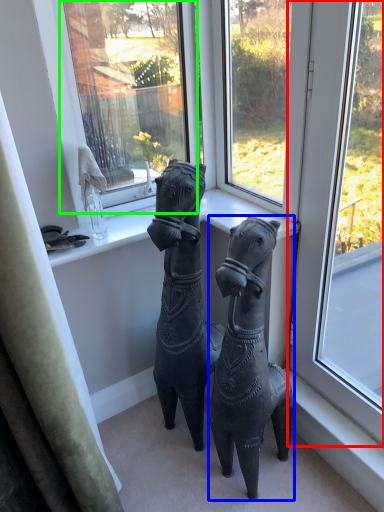
Question: Considering the real-world distances, which object is farthest from window (highlighted by a red box)? horse (highlighted by a blue box) or window screen (highlighted by a green box)?

Choices:
 (A) horse
 (B) window screen

Answer: (B)